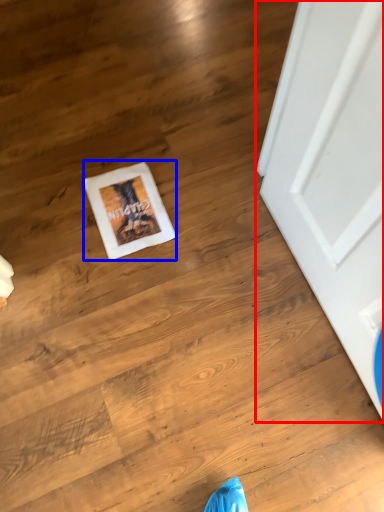
Question: Which object appears closest to the camera in this image, door (highlighted by a red box) or postcard (highlighted by a blue box)?

Choices:
 (A) door
 (B) postcard

Answer: (A)